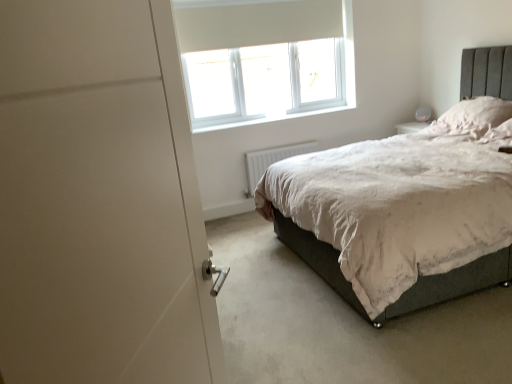
Question: From a real-world perspective, is white fluffy pillow at upper right under white plastic radiator at lower center?

Choices:
 (A) yes
 (B) no

Answer: (B)

Question: Does white fluffy pillow at upper right appear on the right side of white plastic radiator at lower center?

Choices:
 (A) yes
 (B) no

Answer: (A)

Question: From the image's perspective, would you say white fluffy pillow at upper right is shown under white plastic radiator at lower center?

Choices:
 (A) no
 (B) yes

Answer: (A)

Question: Is white plastic radiator at lower center inside white fluffy pillow at upper right?

Choices:
 (A) yes
 (B) no

Answer: (B)

Question: Can you confirm if white fluffy pillow at upper right is thinner than white plastic radiator at lower center?

Choices:
 (A) yes
 (B) no

Answer: (B)

Question: Is white fluffy pillow at upper right outside of white plastic radiator at lower center?

Choices:
 (A) yes
 (B) no

Answer: (A)

Question: From a real-world perspective, is white plastic radiator at lower center below white matte door at left?

Choices:
 (A) no
 (B) yes

Answer: (B)

Question: Are white plastic radiator at lower center and white matte door at left making contact?

Choices:
 (A) yes
 (B) no

Answer: (B)

Question: Considering the relative sizes of white plastic radiator at lower center and white matte door at left in the image provided, is white plastic radiator at lower center thinner than white matte door at left?

Choices:
 (A) yes
 (B) no

Answer: (A)

Question: Would you consider white plastic radiator at lower center to be distant from white matte door at left?

Choices:
 (A) no
 (B) yes

Answer: (B)

Question: From the image's perspective, is white plastic radiator at lower center on top of white matte door at left?

Choices:
 (A) yes
 (B) no

Answer: (A)

Question: Considering the relative sizes of white plastic radiator at lower center and white matte door at left in the image provided, is white plastic radiator at lower center taller than white matte door at left?

Choices:
 (A) no
 (B) yes

Answer: (A)

Question: Is white plastic window at upper center positioned beyond the bounds of white fluffy pillow at upper right?

Choices:
 (A) yes
 (B) no

Answer: (A)